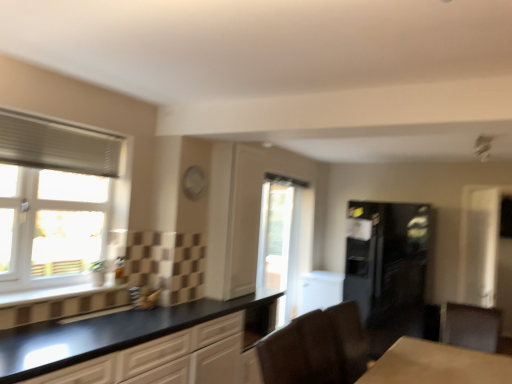
Question: Is the position of matte black cabinet at lower right, which appears as the second cabinetry when viewed from the left, more distant than that of brown leather armchair at lower center?

Choices:
 (A) yes
 (B) no

Answer: (A)

Question: Is matte black cabinet at lower right, which ranks as the 1th cabinetry in right-to-left order, at the left side of brown leather armchair at lower center?

Choices:
 (A) yes
 (B) no

Answer: (B)

Question: Is matte black cabinet at lower right, which ranks as the 1th cabinetry in right-to-left order, closer to camera compared to brown leather armchair at lower center?

Choices:
 (A) yes
 (B) no

Answer: (B)

Question: Can you confirm if matte black cabinet at lower right, which appears as the second cabinetry when viewed from the left, is shorter than brown leather armchair at lower center?

Choices:
 (A) yes
 (B) no

Answer: (B)

Question: Could you tell me if matte black cabinet at lower right, which appears as the second cabinetry when viewed from the left, is facing brown leather armchair at lower center?

Choices:
 (A) yes
 (B) no

Answer: (A)

Question: From a real-world perspective, is matte black cabinet at lower right, which appears as the second cabinetry when viewed from the left, beneath brown leather armchair at lower center?

Choices:
 (A) yes
 (B) no

Answer: (A)

Question: Is white textured window at left, the 1th window when ordered from left to right, facing towards black glossy refrigerator at right?

Choices:
 (A) no
 (B) yes

Answer: (A)

Question: Does white textured window at left, the second window in the back-to-front sequence, have a smaller size compared to black glossy refrigerator at right?

Choices:
 (A) no
 (B) yes

Answer: (B)

Question: Is the position of white textured window at left, acting as the 2th window starting from the right, more distant than that of black glossy refrigerator at right?

Choices:
 (A) no
 (B) yes

Answer: (A)

Question: Is white textured window at left, the 1th window when ordered from left to right, facing away from black glossy refrigerator at right?

Choices:
 (A) no
 (B) yes

Answer: (A)

Question: Is the surface of white textured window at left, which is counted as the 1th window, starting from the front, in direct contact with black glossy refrigerator at right?

Choices:
 (A) yes
 (B) no

Answer: (B)

Question: From the image's perspective, does white textured window at left, acting as the 2th window starting from the right, appear lower than black glossy refrigerator at right?

Choices:
 (A) no
 (B) yes

Answer: (A)

Question: From the image's perspective, does white pleated blind at upper left appear higher than transparent glass door at center, acting as the 2th window starting from the left?

Choices:
 (A) yes
 (B) no

Answer: (A)